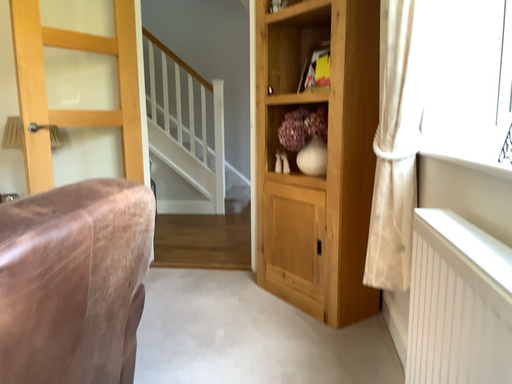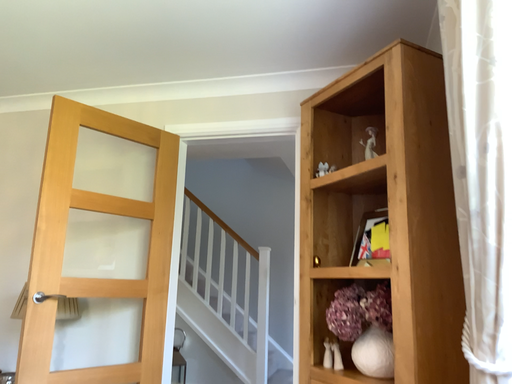
Question: Which way did the camera rotate in the video?

Choices:
 (A) rotated left
 (B) rotated right

Answer: (A)